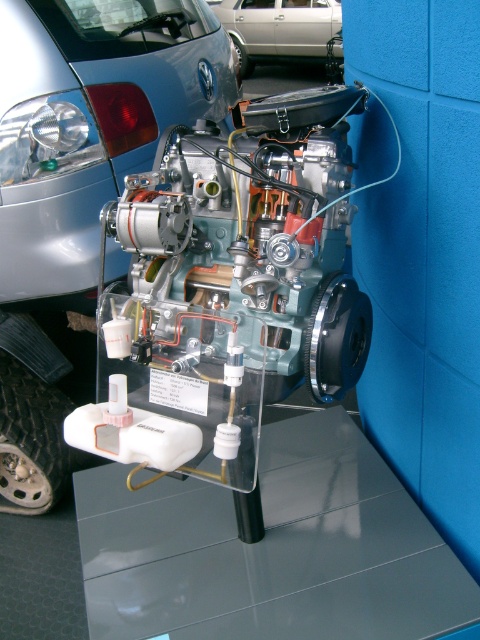
Between point (60, 312) and point (250, 68), which one is positioned behind?

The point (250, 68) is more distant.

Does satin silver engine at center have a lesser height compared to silver metallic car at upper center?

No.

Identify the location of satin silver engine at center. Image resolution: width=480 pixels, height=640 pixels. (79, 192).

Locate an element on the screen. The image size is (480, 640). satin silver engine at center is located at coordinates (79, 192).